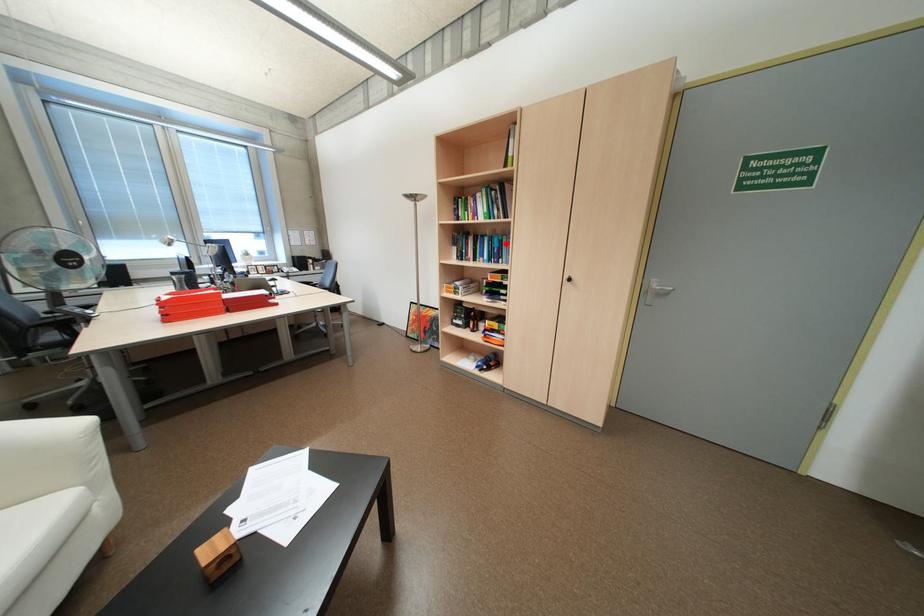
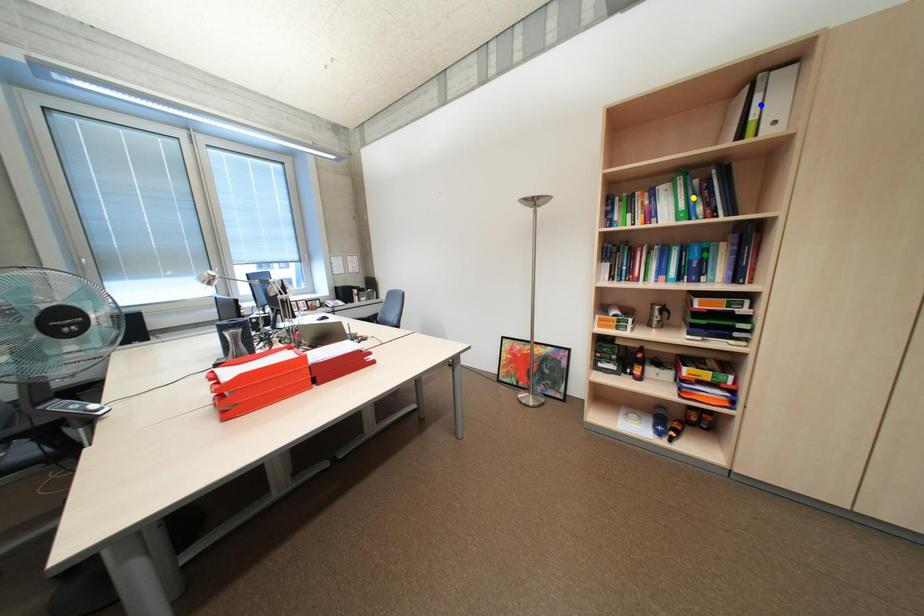
Question: I am providing you with two images of the same scene from different viewpoints. A red point is marked on the first image. You are given multiple points on the second image. Which point in image 2 is actually the same real-world point as the red point in image 1?

Choices:
 (A) yellow point
 (B) blue point
 (C) green point

Answer: (C)